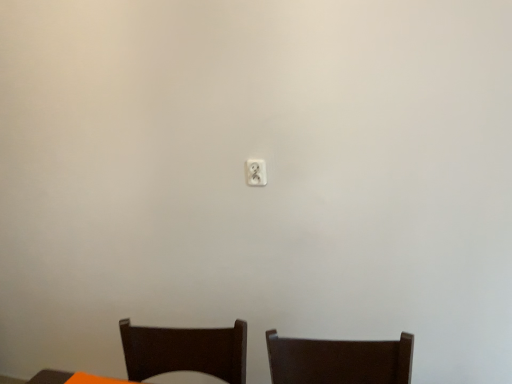
Measure the distance between white plastic light switch at center and camera.

The depth of white plastic light switch at center is 5.02 feet.

This screenshot has width=512, height=384. Describe the element at coordinates (256, 172) in the screenshot. I see `white plastic light switch at center` at that location.

Locate an element on the screen. white plastic light switch at center is located at coordinates (256, 172).

What is the approximate height of white plastic light switch at center?

It is 3.83 inches.

This screenshot has height=384, width=512. What are the coordinates of `white plastic light switch at center` in the screenshot? It's located at (256, 172).